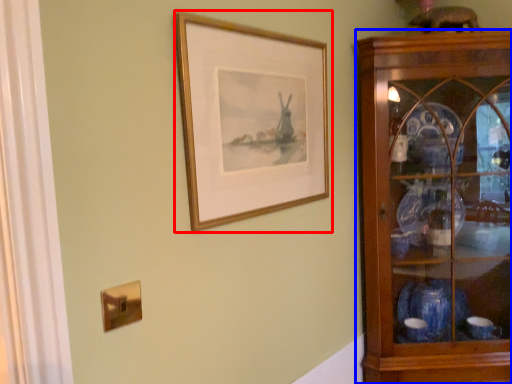
Question: Which point is further to the camera, picture frame (highlighted by a red box) or shelf (highlighted by a blue box)?

Choices:
 (A) picture frame
 (B) shelf

Answer: (B)